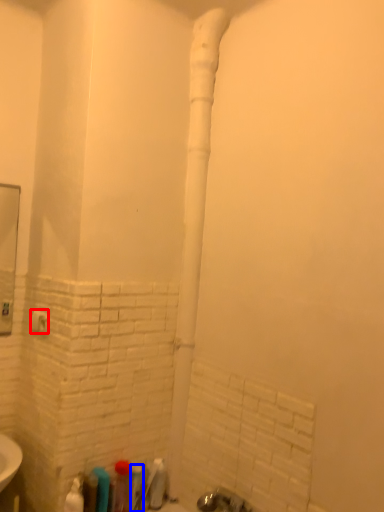
Question: Which point is closer to the camera, towel bar (highlighted by a red box) or toiletry (highlighted by a blue box)?

Choices:
 (A) towel bar
 (B) toiletry

Answer: (B)